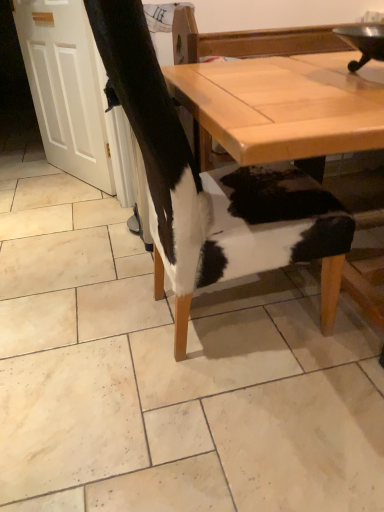
What are the coordinates of `vacant area that lies in front of cowhide chair at center` in the screenshot? It's located at (191, 445).